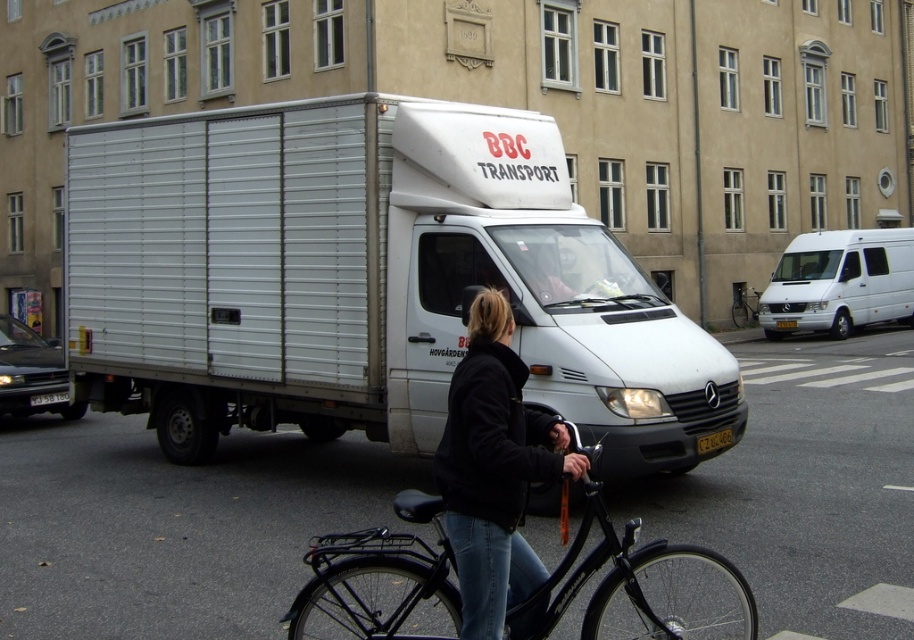
Who is more distant from viewer, [579,538] or [737,284]?

The point [737,284] is more distant.

Who is shorter, black matte bicycle at lower center or black matte bicycle at center?

black matte bicycle at lower center

At what (x,y) coordinates should I click in order to perform the action: click on black matte bicycle at lower center. Please return your answer as a coordinate pair (x, y). Looking at the image, I should click on (641, 588).

Is black soft jacket at center above black matte bicycle at center?

Actually, black soft jacket at center is below black matte bicycle at center.

Measure the distance between black soft jacket at center and camera.

The distance of black soft jacket at center from camera is 3.30 meters.

Where is `black soft jacket at center`? The image size is (914, 640). black soft jacket at center is located at coordinates (494, 468).

In the scene shown: Is black soft jacket at center further to camera compared to white matte van at right?

No, black soft jacket at center is closer to the viewer.

Does black soft jacket at center appear under white matte van at right?

Yes, black soft jacket at center is below white matte van at right.

Is point (532, 467) positioned behind point (851, 246)?

No, (532, 467) is closer to viewer.

Where is `black soft jacket at center`? This screenshot has height=640, width=914. black soft jacket at center is located at coordinates (494, 468).